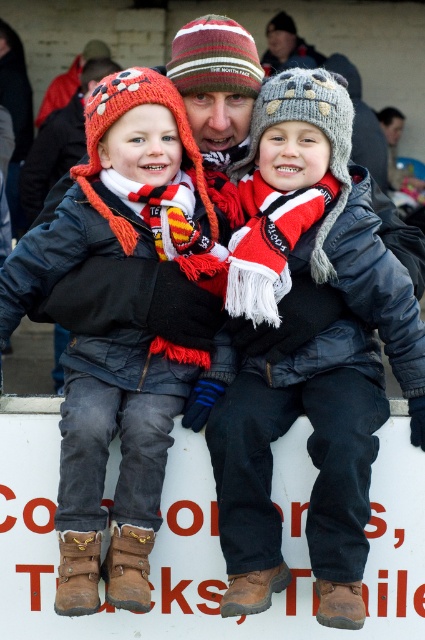
Question: Can you confirm if matte black jacket at center is positioned above knitted woolen hat at center?

Choices:
 (A) no
 (B) yes

Answer: (A)

Question: Is matte black jacket at center wider than knitted woolen hat at center?

Choices:
 (A) no
 (B) yes

Answer: (A)

Question: Which of the following is the farthest from the observer?

Choices:
 (A) matte black jacket at center
 (B) knitted woolen hat at center

Answer: (B)

Question: Which of the following is the farthest from the observer?

Choices:
 (A) (124, 138)
 (B) (393, 276)

Answer: (B)

Question: Which point is farther from the camera taking this photo?

Choices:
 (A) (74, 204)
 (B) (362, 552)

Answer: (A)

Question: Does matte black jacket at center appear under knitted woolen hat at center?

Choices:
 (A) no
 (B) yes

Answer: (B)